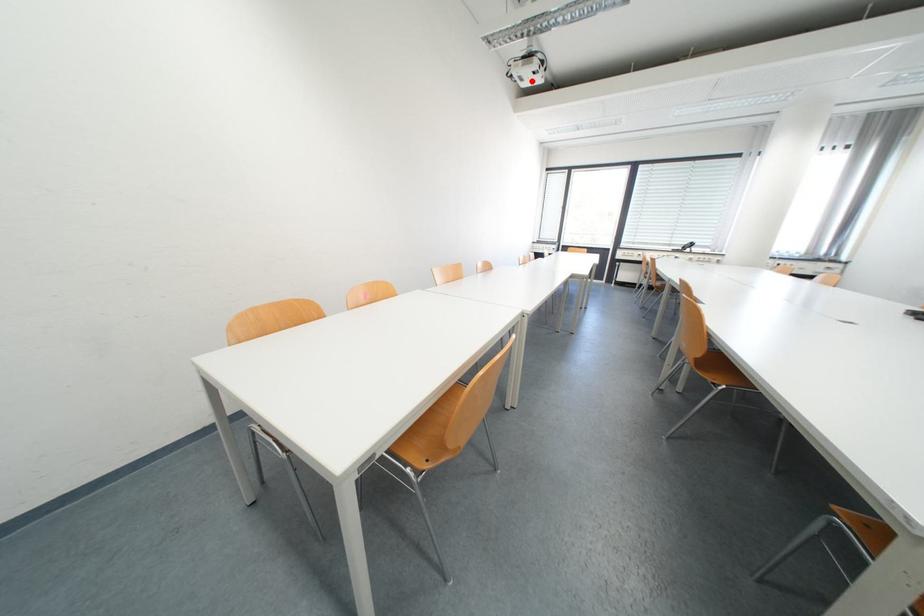
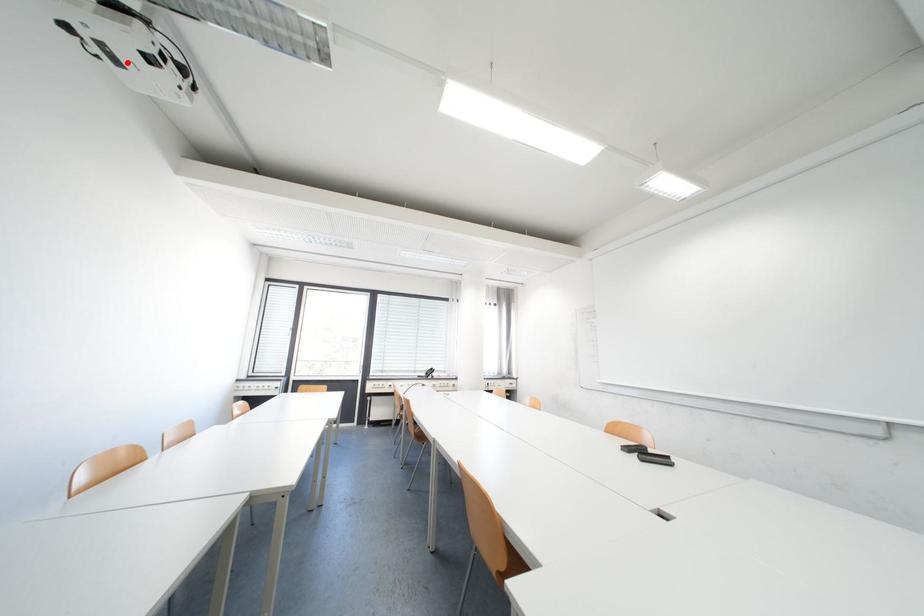
I am providing you with two images of the same scene from different viewpoints. A red point is marked on the first image and another point is marked on the second image. Are the points marked in image1 and image2 representing the same 3D position?

Yes